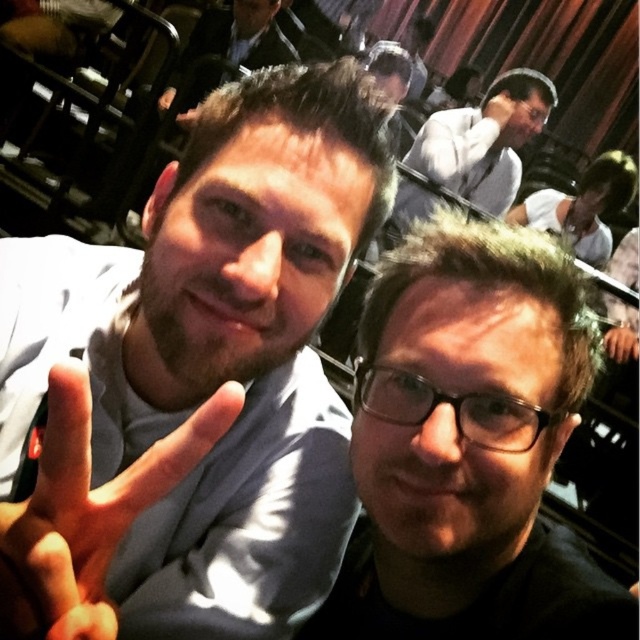
Is skinny-fingered hand at center bigger than dark gray suit at upper center?

No.

Between skinny-fingered hand at center and dark gray suit at upper center, which one is positioned lower?

skinny-fingered hand at center is below.

Which is in front, point (20, 605) or point (244, 38)?

Point (20, 605) is in front.

The image size is (640, 640). Find the location of `skinny-fingered hand at center`. skinny-fingered hand at center is located at coordinates (88, 512).

Is gray fabric shirt at center positioned behind matte black hand at lower right?

No, gray fabric shirt at center is closer to the viewer.

Is gray fabric shirt at center taller than matte black hand at lower right?

Correct, gray fabric shirt at center is much taller as matte black hand at lower right.

The image size is (640, 640). I want to click on gray fabric shirt at center, so (x=193, y=378).

Where is `gray fabric shirt at center`? Image resolution: width=640 pixels, height=640 pixels. gray fabric shirt at center is located at coordinates (193, 378).

The width and height of the screenshot is (640, 640). I want to click on black matte glasses at center, so click(x=468, y=445).

The image size is (640, 640). Describe the element at coordinates (468, 445) in the screenshot. I see `black matte glasses at center` at that location.

At what (x,y) coordinates should I click in order to perform the action: click on black matte glasses at center. Please return your answer as a coordinate pair (x, y). Image resolution: width=640 pixels, height=640 pixels. Looking at the image, I should click on (x=468, y=445).